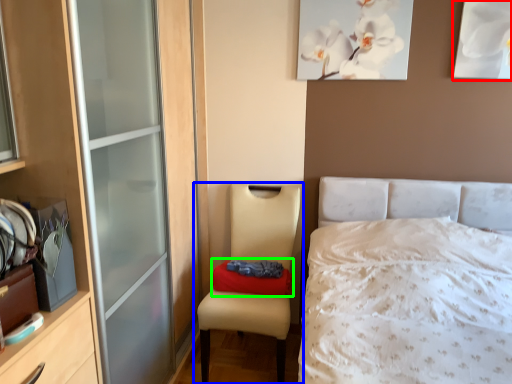
Question: Which object is positioned farthest from picture frame (highlighted by a red box)? Select from chair (highlighted by a blue box) and pillow (highlighted by a green box).

Choices:
 (A) chair
 (B) pillow

Answer: (B)